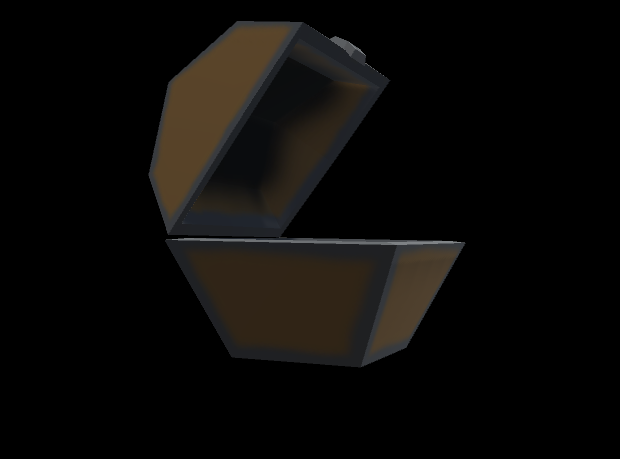
Find the location of a particular element. chest lid is located at coordinates (217, 109).